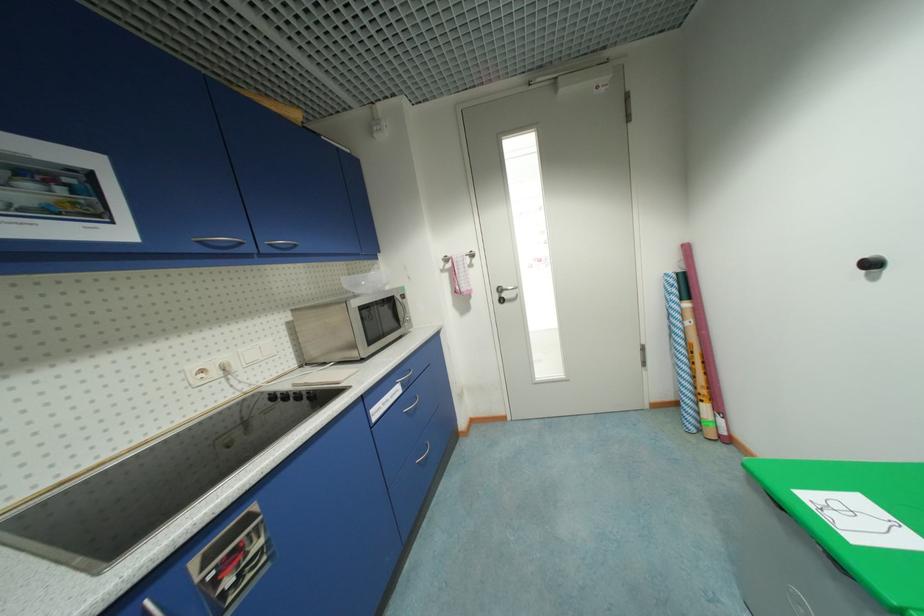
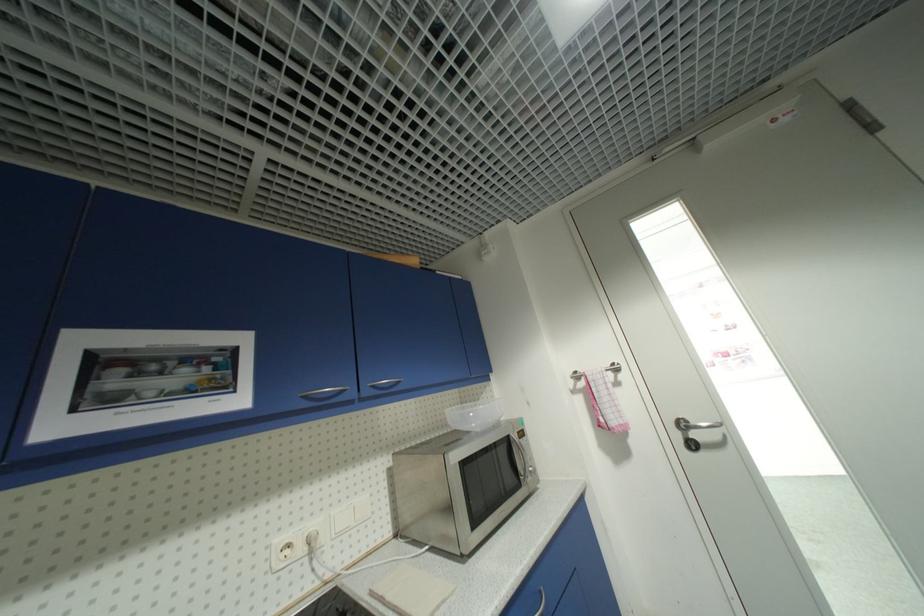
In the second image, find the point that corresponds to (208,371) in the first image.

(294, 546)